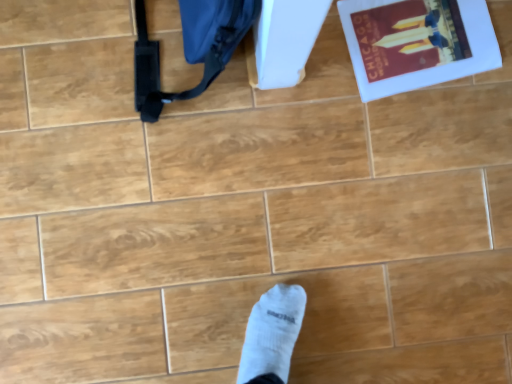
Question: Is matte paper book at upper right shorter than matte blue messenger bag at upper left?

Choices:
 (A) no
 (B) yes

Answer: (B)

Question: Does matte paper book at upper right appear on the right side of matte blue messenger bag at upper left?

Choices:
 (A) yes
 (B) no

Answer: (A)

Question: Is matte paper book at upper right outside of matte blue messenger bag at upper left?

Choices:
 (A) yes
 (B) no

Answer: (A)

Question: Is matte paper book at upper right in front of matte blue messenger bag at upper left?

Choices:
 (A) yes
 (B) no

Answer: (B)

Question: Is matte paper book at upper right at the left side of matte blue messenger bag at upper left?

Choices:
 (A) yes
 (B) no

Answer: (B)

Question: Is matte paper book at upper right positioned far away from matte blue messenger bag at upper left?

Choices:
 (A) no
 (B) yes

Answer: (A)

Question: Considering the relative sizes of matte blue messenger bag at upper left and matte paper book at upper right in the image provided, is matte blue messenger bag at upper left bigger than matte paper book at upper right?

Choices:
 (A) no
 (B) yes

Answer: (B)

Question: From the image's perspective, is matte blue messenger bag at upper left below matte paper book at upper right?

Choices:
 (A) no
 (B) yes

Answer: (B)

Question: Is matte blue messenger bag at upper left to the left of matte paper book at upper right from the viewer's perspective?

Choices:
 (A) yes
 (B) no

Answer: (A)

Question: From the image's perspective, is matte blue messenger bag at upper left located above matte paper book at upper right?

Choices:
 (A) no
 (B) yes

Answer: (A)

Question: Could you tell me if matte blue messenger bag at upper left is facing matte paper book at upper right?

Choices:
 (A) yes
 (B) no

Answer: (B)

Question: Does matte blue messenger bag at upper left have a lesser width compared to matte paper book at upper right?

Choices:
 (A) yes
 (B) no

Answer: (A)

Question: In the image, is matte paper book at upper right on the left side or the right side of matte blue messenger bag at upper left?

Choices:
 (A) right
 (B) left

Answer: (A)